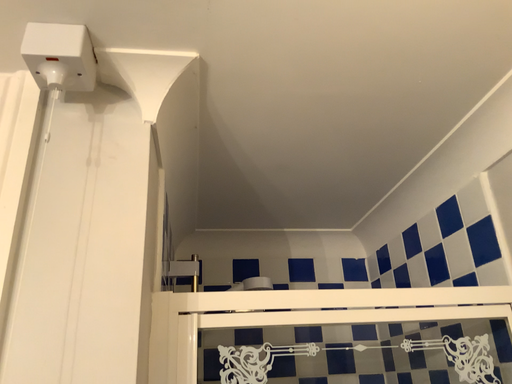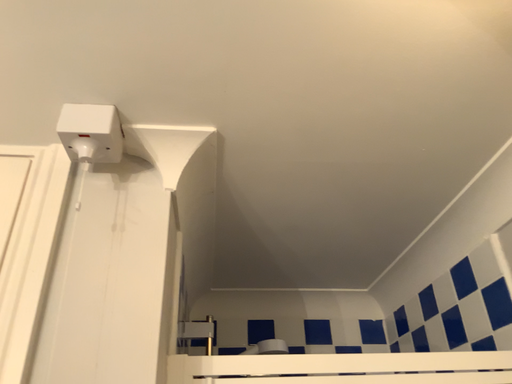
Question: Which way did the camera rotate in the video?

Choices:
 (A) rotated upward
 (B) rotated downward

Answer: (A)